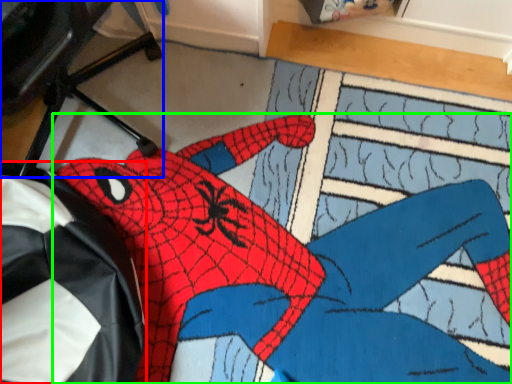
Question: Which object is the closest to the bean bag chair (highlighted by a red box)? Choose among these: computer chair (highlighted by a blue box) or person (highlighted by a green box).

Choices:
 (A) computer chair
 (B) person

Answer: (B)